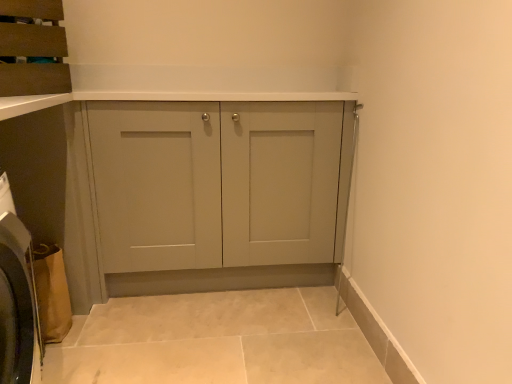
Where is `brown fabric washing machine at lower left`? brown fabric washing machine at lower left is located at coordinates (16, 301).

The image size is (512, 384). Identify the location of matte gray cabinet at center. (215, 183).

Find the location of a particular element. The image size is (512, 384). matte brown cabinet at upper left is located at coordinates (32, 55).

I want to click on brown fabric washing machine at lower left, so click(x=16, y=301).

Does matte brown cabinet at upper left have a larger size compared to matte gray cabinet at center?

No.

Would you say matte brown cabinet at upper left is inside or outside matte gray cabinet at center?

matte brown cabinet at upper left is outside matte gray cabinet at center.

Consider the image. From the image's perspective, which is below, matte brown cabinet at upper left or matte gray cabinet at center?

matte gray cabinet at center.

Is matte brown cabinet at upper left facing away from matte gray cabinet at center?

No, matte brown cabinet at upper left is not facing away from matte gray cabinet at center.

Could you tell me if matte gray cabinet at center is facing brown fabric washing machine at lower left?

Yes, matte gray cabinet at center is aimed at brown fabric washing machine at lower left.

From the image's perspective, between matte gray cabinet at center and brown fabric washing machine at lower left, who is located below?

From the image's view, brown fabric washing machine at lower left is below.

Is brown fabric washing machine at lower left a part of matte gray cabinet at center?

No, brown fabric washing machine at lower left is not a part of matte gray cabinet at center.

Are matte gray cabinet at center and brown fabric washing machine at lower left located far from each other?

No, matte gray cabinet at center is not far from brown fabric washing machine at lower left.

Is the surface of matte gray cabinet at center in direct contact with matte brown cabinet at upper left?

matte gray cabinet at center and matte brown cabinet at upper left are clearly separated.

In terms of size, does matte gray cabinet at center appear bigger or smaller than matte brown cabinet at upper left?

matte gray cabinet at center is bigger than matte brown cabinet at upper left.

What are the coordinates of `cupboard on the right of matte brown cabinet at upper left` in the screenshot? It's located at (215, 183).

Which is more to the right, matte gray cabinet at center or matte brown cabinet at upper left?

matte gray cabinet at center is more to the right.

From the image's perspective, is brown fabric washing machine at lower left over matte gray cabinet at center?

No.

Are brown fabric washing machine at lower left and matte gray cabinet at center beside each other?

No, brown fabric washing machine at lower left is not making contact with matte gray cabinet at center.

Considering the positions of objects brown fabric washing machine at lower left and matte gray cabinet at center in the image provided, who is behind, brown fabric washing machine at lower left or matte gray cabinet at center?

matte gray cabinet at center.

Which object is thinner, matte brown cabinet at upper left or brown fabric washing machine at lower left?

Thinner between the two is brown fabric washing machine at lower left.

Consider the image. From the image's perspective, which object appears higher, matte brown cabinet at upper left or brown fabric washing machine at lower left?

From the image's view, matte brown cabinet at upper left is above.

From the picture: Between matte brown cabinet at upper left and brown fabric washing machine at lower left, which one appears on the right side from the viewer's perspective?

Positioned to the right is brown fabric washing machine at lower left.

From a real-world perspective, is brown fabric washing machine at lower left above or below matte brown cabinet at upper left?

brown fabric washing machine at lower left is situated lower than matte brown cabinet at upper left in the real world.

How many degrees apart are the facing directions of brown fabric washing machine at lower left and matte brown cabinet at upper left?

The angle between the facing direction of brown fabric washing machine at lower left and the facing direction of matte brown cabinet at upper left is 44.1 degrees.

Is brown fabric washing machine at lower left not close to matte brown cabinet at upper left?

They are positioned close to each other.

Consider the image. Is brown fabric washing machine at lower left not inside matte brown cabinet at upper left?

That's correct, brown fabric washing machine at lower left is outside of matte brown cabinet at upper left.

This screenshot has width=512, height=384. Identify the location of cupboard beneath the matte brown cabinet at upper left (from a real-world perspective). [x=215, y=183].

I want to click on washing machine on the left of matte gray cabinet at center, so click(x=16, y=301).

From the image, which object appears to be farther from brown fabric washing machine at lower left, matte gray cabinet at center or matte brown cabinet at upper left?

Among the two, matte gray cabinet at center is located further to brown fabric washing machine at lower left.

Estimate the real-world distances between objects in this image. Which object is closer to matte brown cabinet at upper left, matte gray cabinet at center or brown fabric washing machine at lower left?

brown fabric washing machine at lower left lies closer to matte brown cabinet at upper left than the other object.

Considering their positions, is brown fabric washing machine at lower left positioned further to matte brown cabinet at upper left than matte gray cabinet at center?

matte gray cabinet at center.

Looking at the image, which one is located closer to matte gray cabinet at center, brown fabric washing machine at lower left or matte brown cabinet at upper left?

matte brown cabinet at upper left is positioned closer to the anchor matte gray cabinet at center.

When comparing their distances from brown fabric washing machine at lower left, does matte brown cabinet at upper left or matte gray cabinet at center seem closer?

matte brown cabinet at upper left.

When comparing their distances from matte gray cabinet at center, does matte brown cabinet at upper left or brown fabric washing machine at lower left seem closer?

matte brown cabinet at upper left is closer to matte gray cabinet at center.

Locate an element on the screen. The width and height of the screenshot is (512, 384). cupboard between matte brown cabinet at upper left and brown fabric washing machine at lower left vertically is located at coordinates (215, 183).